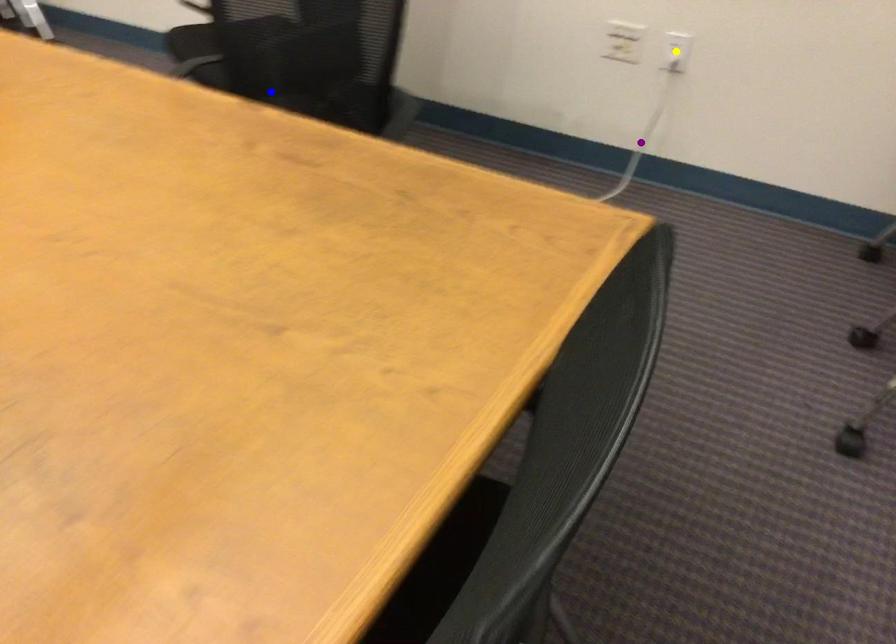
Order these from nearest to farthest:
blue point
yellow point
purple point

purple point, yellow point, blue point